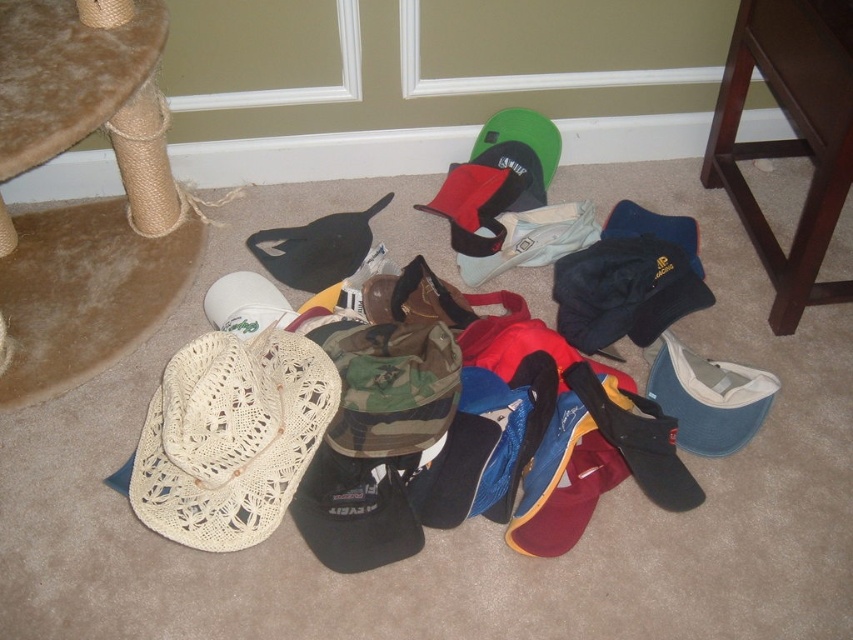
Question: Is woven straw cowboy hat at lower left smaller than velvet-like brown stool at upper left?

Choices:
 (A) no
 (B) yes

Answer: (B)

Question: Among these points, which one is nearest to the camera?

Choices:
 (A) (231, 529)
 (B) (26, 140)

Answer: (B)

Question: Estimate the real-world distances between objects in this image. Which object is closer to the woven straw cowboy hat at lower left?

Choices:
 (A) velvet-like brown stool at upper left
 (B) dark wood stool at lower right

Answer: (A)

Question: Which object is farther from the camera taking this photo?

Choices:
 (A) velvet-like brown stool at upper left
 (B) woven straw cowboy hat at lower left

Answer: (B)

Question: Can you confirm if velvet-like brown stool at upper left is positioned above dark wood stool at lower right?

Choices:
 (A) no
 (B) yes

Answer: (B)

Question: Considering the relative positions of velvet-like brown stool at upper left and dark wood stool at lower right in the image provided, where is velvet-like brown stool at upper left located with respect to dark wood stool at lower right?

Choices:
 (A) below
 (B) above

Answer: (B)